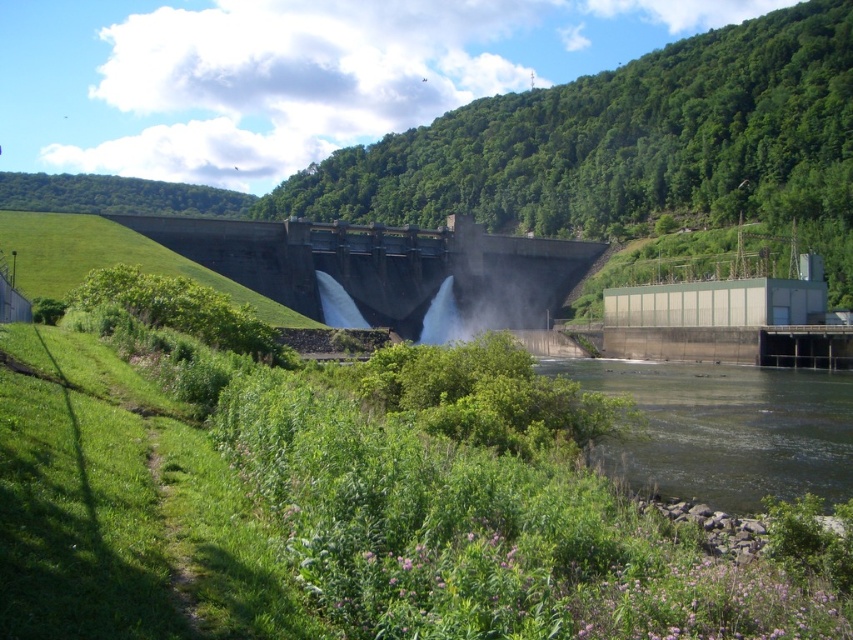
You are a civil engineer inspecting the dam. You notice a point labeled at coordinates (724, 429). Based on the scene, what structure does this point most likely indicate?

The point at coordinates (724, 429) corresponds to the greenish gray concrete waterway at lower right.

You are standing at the base of the dam and want to reach a specific point marked at coordinates point (677, 429). If your maximum comfortable walking distance is 50 meters, will you be able to comfortably walk to that point?

The point (677, 429) is 49.93 meters from the viewer, so yes, you can comfortably walk to that point since it is within your 50 meters limit.